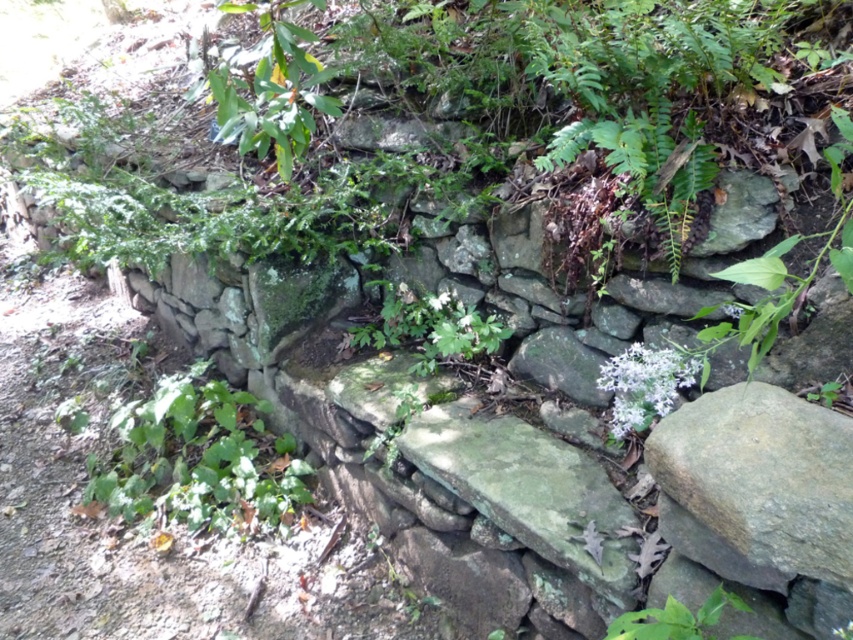
I want to click on gray rough stone at lower right, so click(763, 476).

What do you see at coordinates (763, 476) in the screenshot? This screenshot has height=640, width=853. I see `gray rough stone at lower right` at bounding box center [763, 476].

Does point (784, 419) lie behind point (616, 388)?

That is False.

Identify the location of gray rough stone at lower right. (763, 476).

Is green leafy plant at center positioned before white matte flower at center-right?

No, it is behind white matte flower at center-right.

Describe the element at coordinates (428, 326) in the screenshot. This screenshot has height=640, width=853. I see `green leafy plant at center` at that location.

Identify the location of green leafy plant at center. This screenshot has height=640, width=853. (428, 326).

Where is `green leafy plant at center`? The width and height of the screenshot is (853, 640). green leafy plant at center is located at coordinates (428, 326).

Looking at this image, does gray rough stone at lower right have a lesser height compared to green leafy plant at center?

Correct, gray rough stone at lower right is not as tall as green leafy plant at center.

Is the position of gray rough stone at lower right more distant than that of green leafy plant at center?

That is False.

Which is behind, point (799, 548) or point (426, 346)?

Positioned behind is point (426, 346).

At what (x,y) coordinates should I click in order to perform the action: click on gray rough stone at lower right. Please return your answer as a coordinate pair (x, y). The width and height of the screenshot is (853, 640). Looking at the image, I should click on (763, 476).